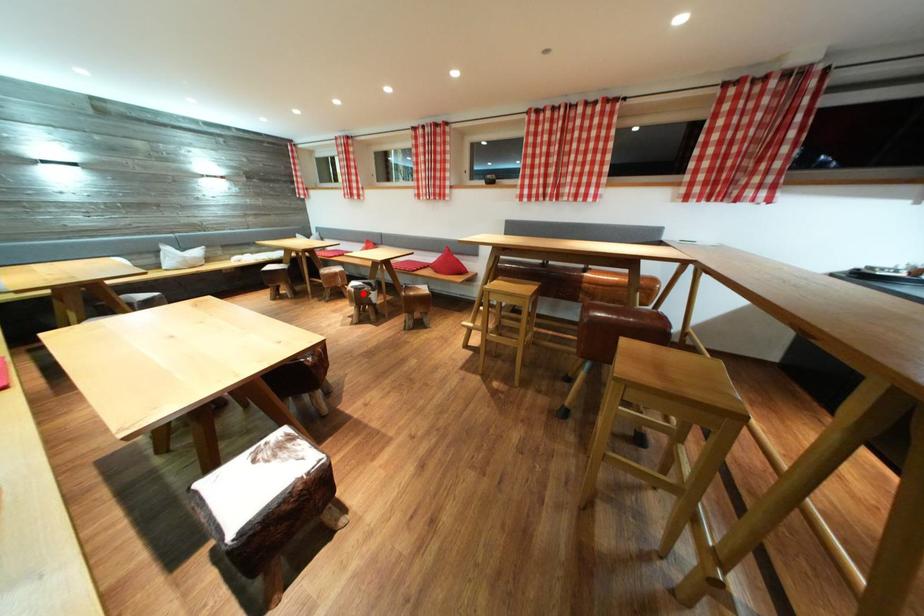
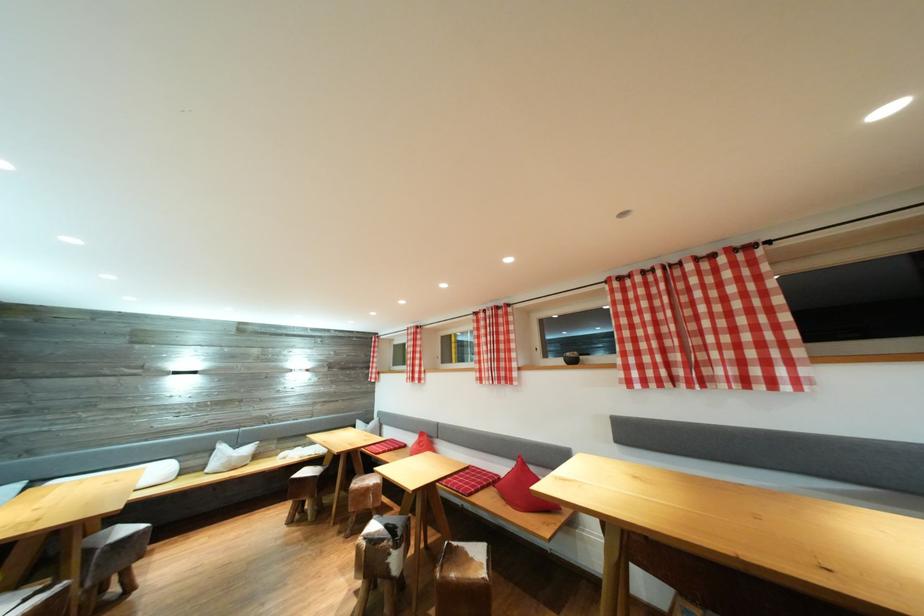
The point at the highlighted location is marked in the first image. Where is the corresponding point in the second image?

(377, 546)